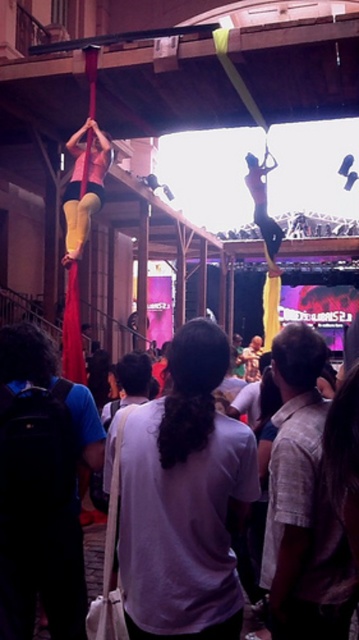
Does matte yellow leggings at left come behind skinny white pole at upper center?

No, it is not.

Is matte yellow leggings at left to the right of skinny white pole at upper center from the viewer's perspective?

In fact, matte yellow leggings at left is to the left of skinny white pole at upper center.

Locate an element on the screen. The height and width of the screenshot is (640, 359). matte yellow leggings at left is located at coordinates (86, 188).

Is white cotton shirt at center below matte yellow leggings at left?

Yes, white cotton shirt at center is below matte yellow leggings at left.

Is white cotton shirt at center positioned at the back of matte yellow leggings at left?

No, it is in front of matte yellow leggings at left.

Who is more forward, [187,582] or [82,218]?

Point [187,582] is more forward.

Identify the location of white cotton shirt at center. (184, 499).

Can you confirm if white cotton shirt at center is smaller than skinny white pole at upper center?

Yes, white cotton shirt at center is smaller than skinny white pole at upper center.

Can you confirm if white cotton shirt at center is positioned above skinny white pole at upper center?

No.

This screenshot has width=359, height=640. I want to click on white cotton shirt at center, so click(x=184, y=499).